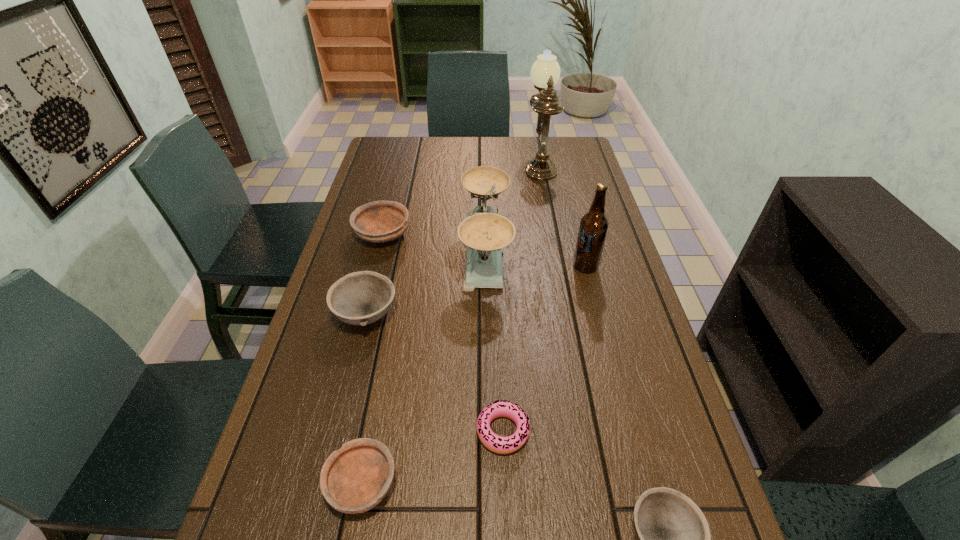
Locate an element on the screen. vacant space located on the right of the farthest bowl is located at coordinates click(x=436, y=235).

Image resolution: width=960 pixels, height=540 pixels. Identify the location of vacant space located on the right of the smaller brown bowl. (533, 484).

Where is `blank space located on the right of the pink doughnut`? The image size is (960, 540). blank space located on the right of the pink doughnut is located at coordinates (582, 431).

I want to click on object present at the far edge, so click(x=545, y=72).

Locate an element on the screen. The image size is (960, 540). oil lamp that is at the right edge is located at coordinates coord(545,72).

Locate an element on the screen. Image resolution: width=960 pixels, height=540 pixels. beer bottle positioned at the right edge is located at coordinates coord(594,224).

This screenshot has width=960, height=540. What are the coordinates of `object located in the far right corner section of the desktop` in the screenshot? It's located at (545, 72).

Image resolution: width=960 pixels, height=540 pixels. Find the location of `vacant space at the far edge of the desktop`. vacant space at the far edge of the desktop is located at coordinates (522, 143).

The height and width of the screenshot is (540, 960). I want to click on free space at the left edge of the desktop, so click(347, 359).

Where is `vacant space at the right edge of the desktop`? The image size is (960, 540). vacant space at the right edge of the desktop is located at coordinates (558, 199).